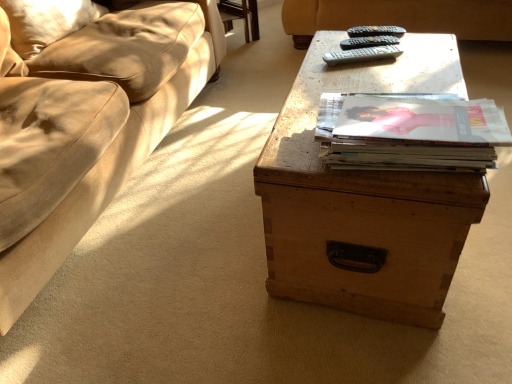
Identify the location of empty space that is in between gray plastic remote at upper center, which ranks as the 3th remote in top-to-bottom order, and matte paper stack of magazines at center. (379, 75).